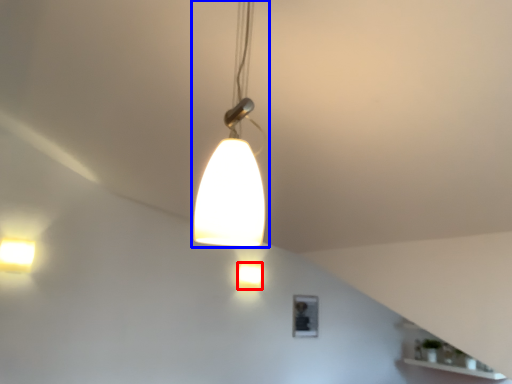
Question: Among these objects, which one is farthest to the camera, lamp (highlighted by a red box) or lamp (highlighted by a blue box)?

Choices:
 (A) lamp
 (B) lamp

Answer: (A)